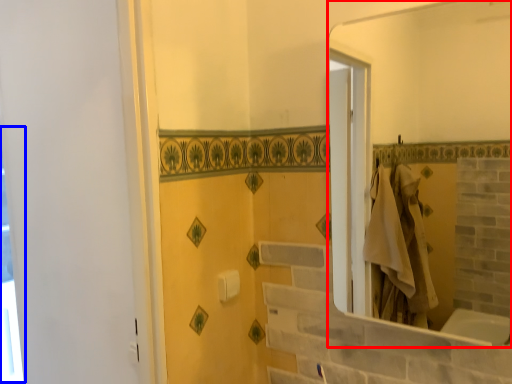
Question: Among these objects, which one is nearest to the camera, mirror (highlighted by a red box) or window (highlighted by a blue box)?

Choices:
 (A) mirror
 (B) window

Answer: (A)